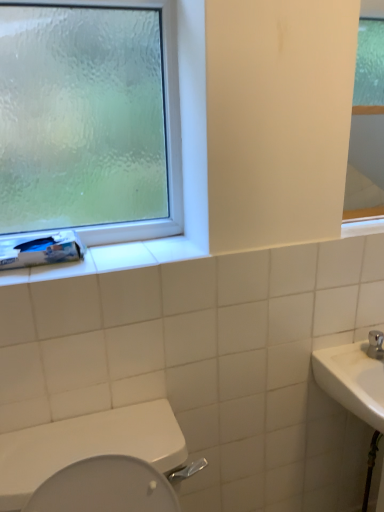
Question: Can you confirm if frosted glass window at upper left is taller than white glossy mirror at upper right?

Choices:
 (A) yes
 (B) no

Answer: (A)

Question: Considering the relative sizes of frosted glass window at upper left and white glossy mirror at upper right in the image provided, is frosted glass window at upper left smaller than white glossy mirror at upper right?

Choices:
 (A) yes
 (B) no

Answer: (B)

Question: Considering the relative sizes of frosted glass window at upper left and white glossy mirror at upper right in the image provided, is frosted glass window at upper left thinner than white glossy mirror at upper right?

Choices:
 (A) yes
 (B) no

Answer: (B)

Question: Is frosted glass window at upper left to the right of white glossy mirror at upper right from the viewer's perspective?

Choices:
 (A) no
 (B) yes

Answer: (A)

Question: Is white glossy mirror at upper right located within frosted glass window at upper left?

Choices:
 (A) yes
 (B) no

Answer: (B)

Question: Can you confirm if frosted glass window at upper left is bigger than white glossy mirror at upper right?

Choices:
 (A) no
 (B) yes

Answer: (B)

Question: Is white glossy mirror at upper right shorter than frosted glass window at upper left?

Choices:
 (A) no
 (B) yes

Answer: (B)

Question: Is white glossy mirror at upper right facing towards frosted glass window at upper left?

Choices:
 (A) yes
 (B) no

Answer: (B)

Question: From the image's perspective, is white glossy mirror at upper right over frosted glass window at upper left?

Choices:
 (A) no
 (B) yes

Answer: (A)

Question: Can you confirm if white glossy mirror at upper right is positioned to the left of frosted glass window at upper left?

Choices:
 (A) no
 (B) yes

Answer: (A)

Question: Is white glossy mirror at upper right positioned before frosted glass window at upper left?

Choices:
 (A) no
 (B) yes

Answer: (A)

Question: From the image's perspective, is white glossy mirror at upper right under frosted glass window at upper left?

Choices:
 (A) yes
 (B) no

Answer: (A)

Question: Is white matte toilet paper at left not near frosted glass window at upper left?

Choices:
 (A) yes
 (B) no

Answer: (B)